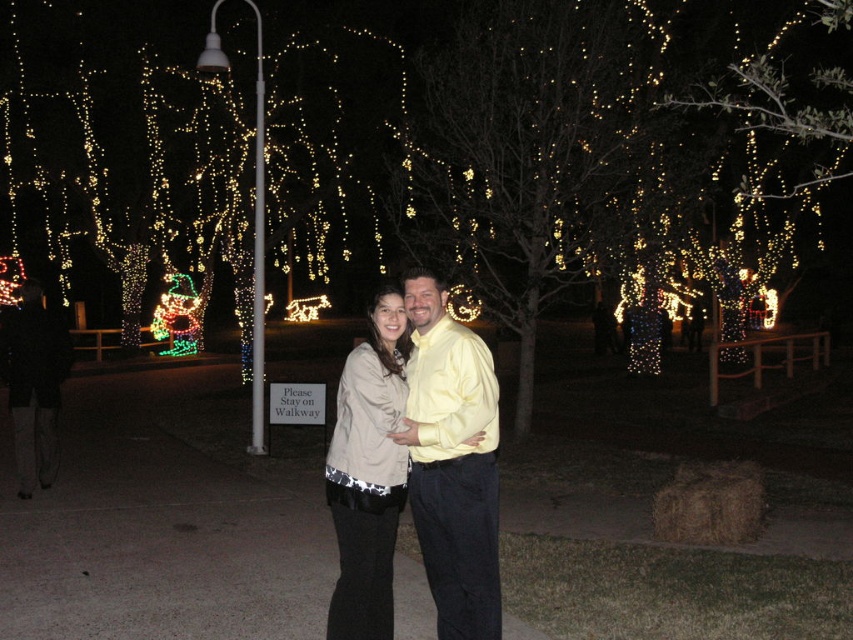
Question: Can you confirm if matte beige jacket at center is wider than beige fabric jacket at center?

Choices:
 (A) yes
 (B) no

Answer: (A)

Question: Does matte beige jacket at center appear over beige fabric jacket at center?

Choices:
 (A) yes
 (B) no

Answer: (A)

Question: Is matte beige jacket at center below beige fabric jacket at center?

Choices:
 (A) yes
 (B) no

Answer: (B)

Question: Which point is farther to the camera?

Choices:
 (A) beige fabric jacket at center
 (B) matte beige jacket at center

Answer: (A)